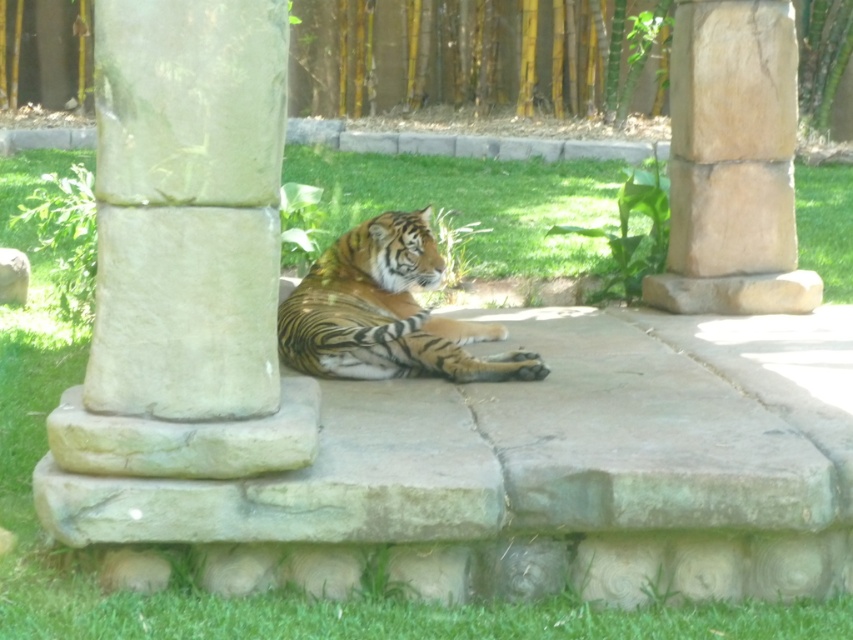
Question: Is smooth stone pillar at center to the right of smooth beige stone at lower left from the viewer's perspective?

Choices:
 (A) no
 (B) yes

Answer: (B)

Question: From the image, what is the correct spatial relationship of orange-yellow tiger at center in relation to smooth beige stone at lower left?

Choices:
 (A) below
 (B) above

Answer: (A)

Question: Does smooth stone pillar at center have a greater width compared to orange-yellow tiger at center?

Choices:
 (A) no
 (B) yes

Answer: (A)

Question: Which point is closer to the camera?

Choices:
 (A) orange-yellow tiger at center
 (B) smooth beige stone at lower left
 (C) smooth stone pillar at center

Answer: (C)

Question: Based on their relative distances, which object is farther from the smooth beige stone at lower left?

Choices:
 (A) smooth stone pillar at center
 (B) orange-yellow tiger at center

Answer: (A)

Question: Which point appears farthest from the camera in this image?

Choices:
 (A) (776, 170)
 (B) (428, 252)
 (C) (128, 35)
 (D) (22, 298)

Answer: (D)